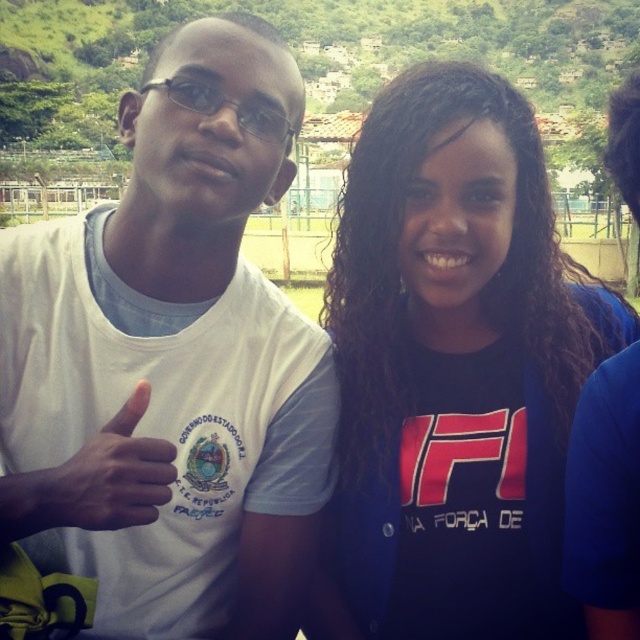
Which is more to the right, dark blue jersey at center or white matte hand at left?

Positioned to the right is dark blue jersey at center.

Does dark blue jersey at center appear over white matte hand at left?

Indeed, dark blue jersey at center is positioned over white matte hand at left.

The width and height of the screenshot is (640, 640). Find the location of `dark blue jersey at center`. dark blue jersey at center is located at coordinates (452, 371).

You are a GUI agent. You are given a task and a screenshot of the screen. Output one action in this format:
    pyautogui.click(x=<x>, y=<y>)
    Task: Click on the dark blue jersey at center
    
    Given the screenshot: What is the action you would take?
    pyautogui.click(x=452, y=371)

Who is more forward, [328,442] or [113,449]?

Point [113,449] is in front.

Does white matte t-shirt at center have a smaller size compared to white matte hand at left?

Incorrect, white matte t-shirt at center is not smaller in size than white matte hand at left.

Is point (259, 547) positioned after point (128, 410)?

Yes, point (259, 547) is behind point (128, 410).

Where is `white matte t-shirt at center`? Image resolution: width=640 pixels, height=640 pixels. white matte t-shirt at center is located at coordinates (172, 364).

Which is above, white matte t-shirt at center or dark blue jersey at center?

white matte t-shirt at center is higher up.

Between white matte t-shirt at center and dark blue jersey at center, which one has more height?

Standing taller between the two is white matte t-shirt at center.

Locate an element on the screen. The image size is (640, 640). white matte t-shirt at center is located at coordinates (172, 364).